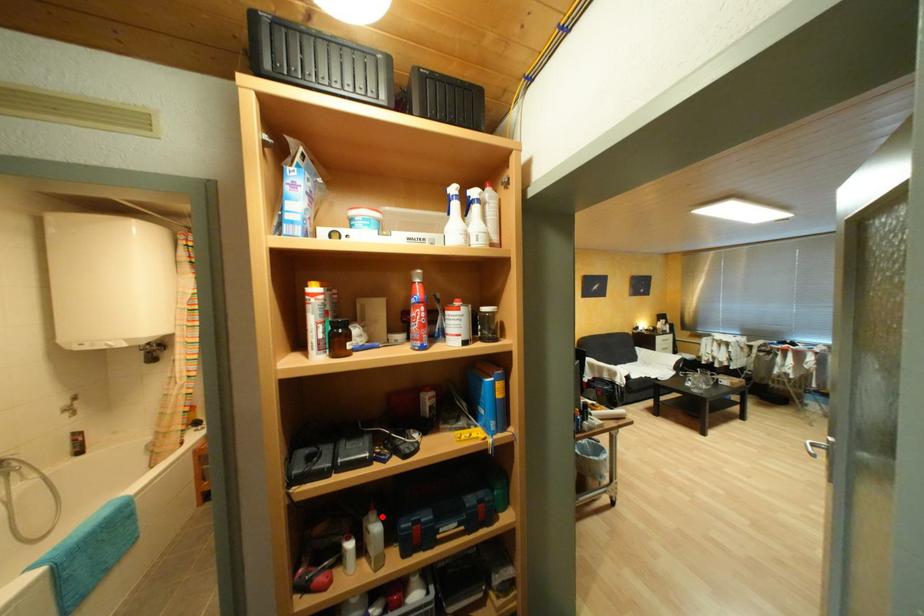
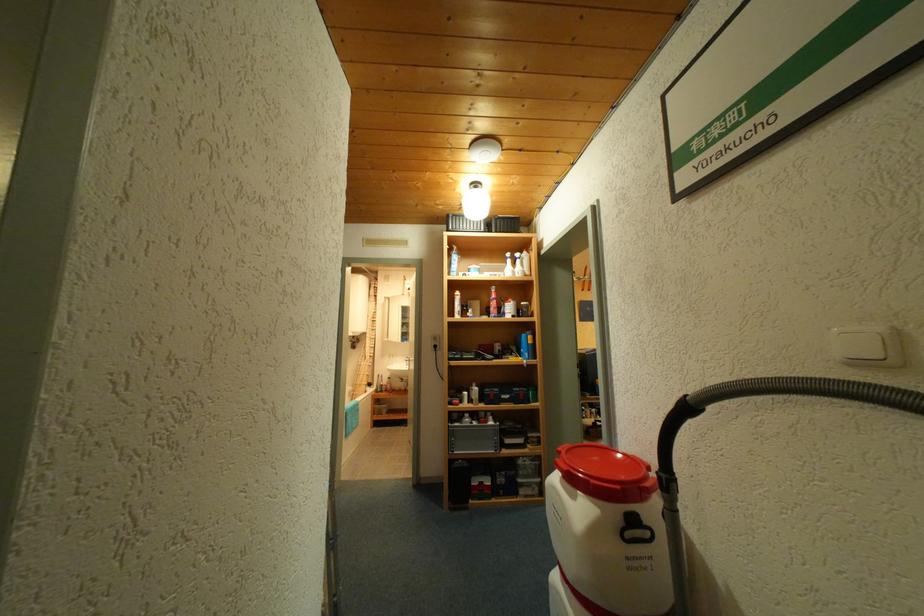
Find the pixel in the second image that matches the highlighted location in the first image.

(483, 386)